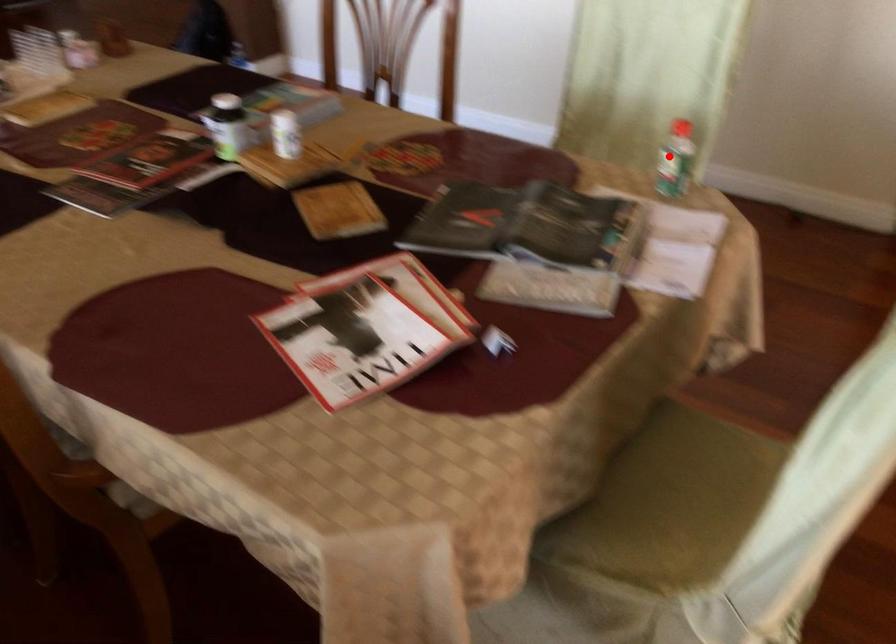
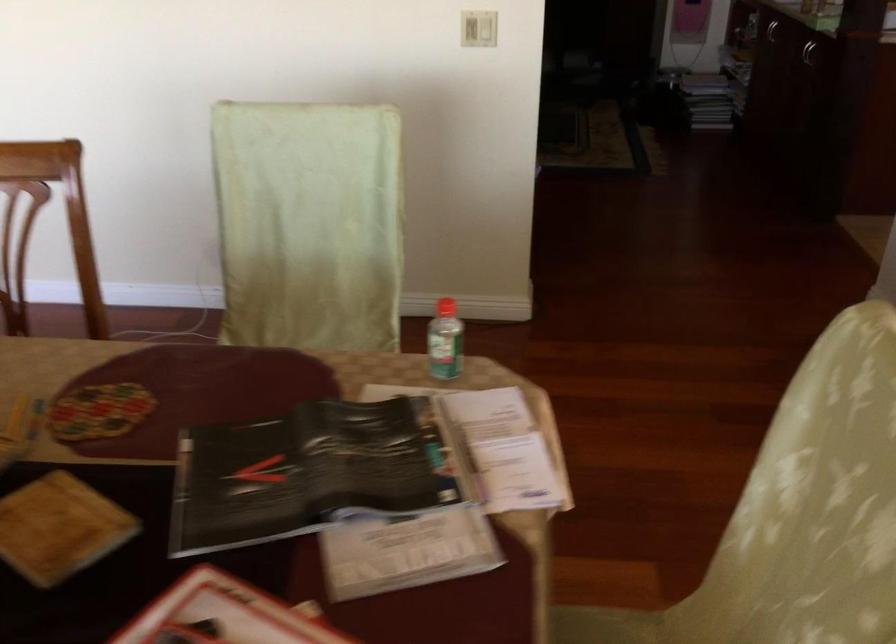
The point at the highlighted location is marked in the first image. Where is the corresponding point in the second image?

(444, 341)